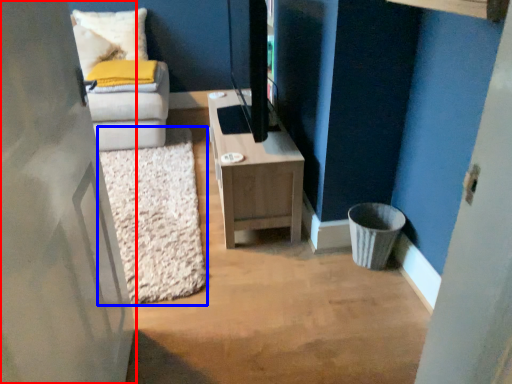
Question: Among these objects, which one is farthest to the camera, door (highlighted by a red box) or mat (highlighted by a blue box)?

Choices:
 (A) door
 (B) mat

Answer: (B)